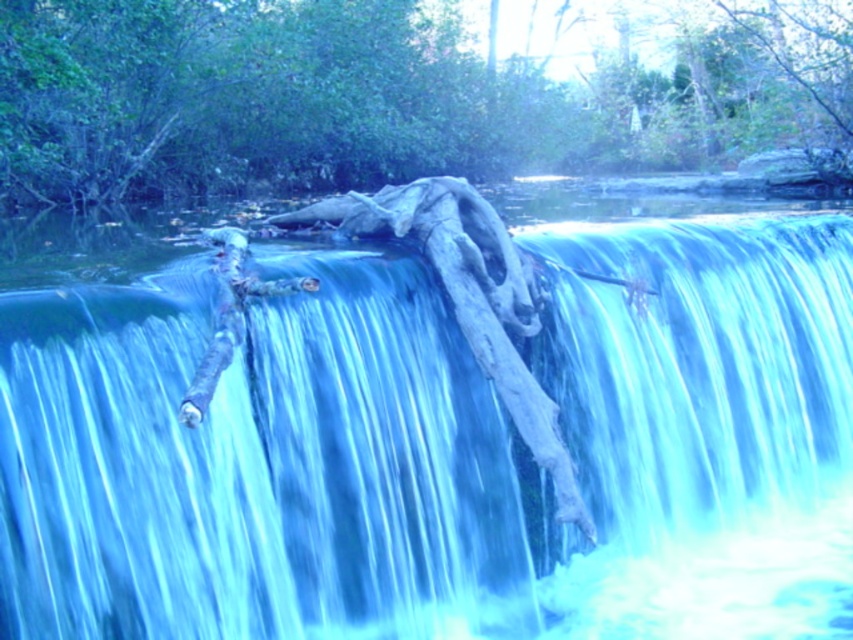
Who is positioned more to the left, smooth wood log at center or smooth bark log at center?

smooth wood log at center

Can you confirm if smooth wood log at center is positioned above smooth bark log at center?

Actually, smooth wood log at center is below smooth bark log at center.

Between point (433, 285) and point (820, 13), which one is positioned in front?

Point (433, 285)

What are the coordinates of `smooth wood log at center` in the screenshot? It's located at (434, 438).